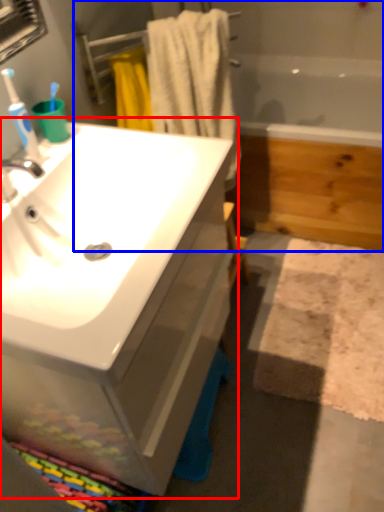
Question: Which object is closer to the camera taking this photo, bathroom cabinet (highlighted by a red box) or bath (highlighted by a blue box)?

Choices:
 (A) bathroom cabinet
 (B) bath

Answer: (A)